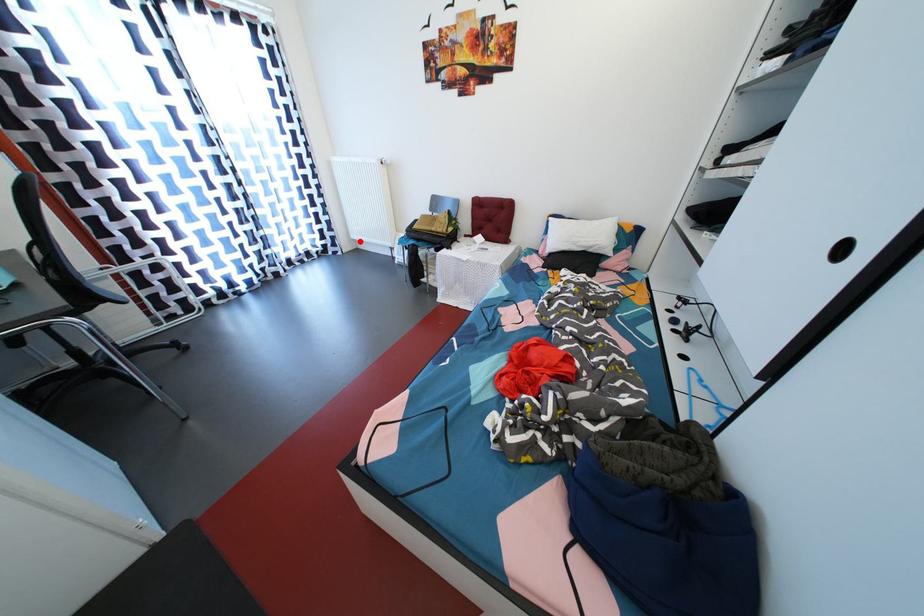
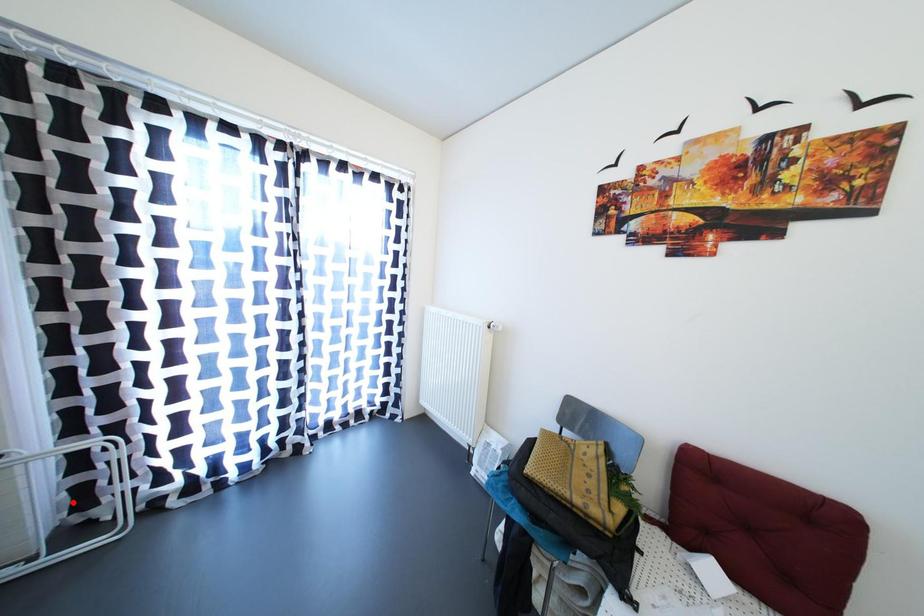
I am providing you with two images of the same scene from different viewpoints. A red point is marked on the first image and another point is marked on the second image. Is the marked point in image1 the same physical position as the marked point in image2?

No